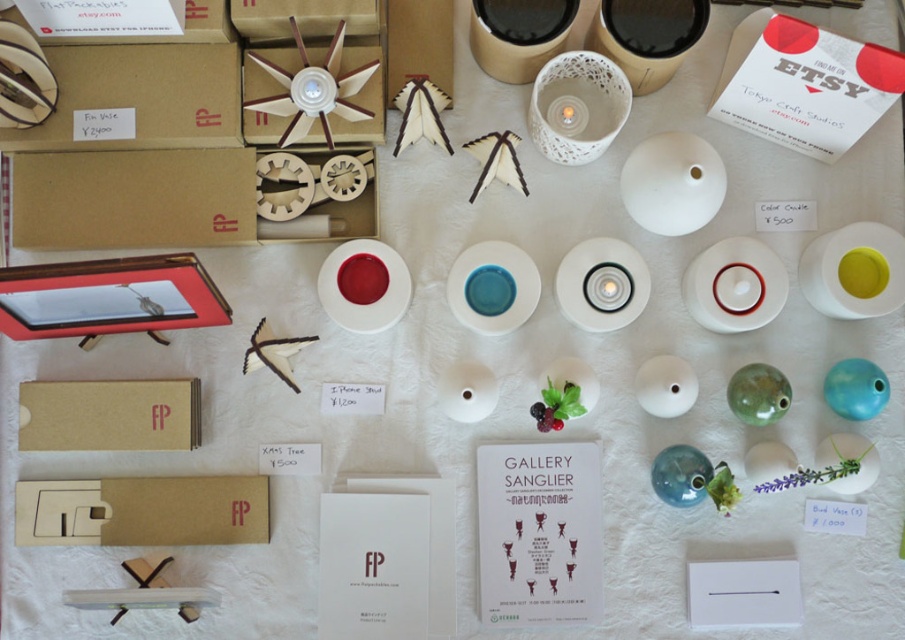
You are an organizer at the craft fair and need to place a new item between the brown cardboard box at lower left and the yellow matte plate at center right. Based on their current positions, where should you place the new item to ensure it is between them?

The brown cardboard box at lower left is located below the yellow matte plate at center right. To place the new item between them, position it above the brown cardboard box at lower left and below the yellow matte plate at center right.

Consider the image. You are at the craft fair and need to place a new item on the table. The item requires a space that is not occupied by the brown cardboard box at lower left. Where should you place it?

Since the brown cardboard box at lower left is located at point (110, 413), you should place the new item in an area of the table that does not overlap with this coordinate.

You are at a craft fair and see the matte cardboard box at upper left displayed at point (139, 97). Can you determine if this box is located in the upper half of the image?

The matte cardboard box at upper left is represented by point (139, 97). Since the y coordinate is 0.155, which is less than 0.5, it is located in the upper half of the image.